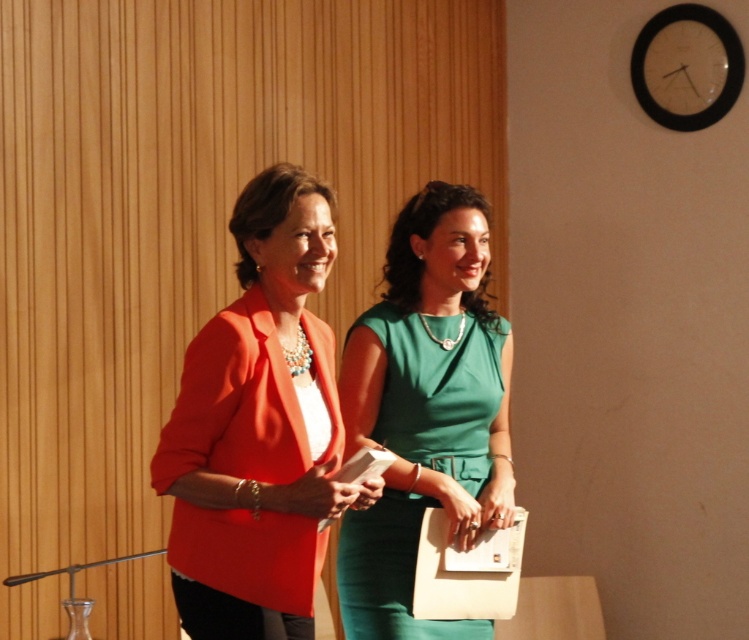
You are standing in a room with two women. The woman on the left is wearing a bright orange blazer and the woman on the right is in a green dress. There is a point at coordinates point (288, 605). Can you tell me how far this point is from you?

The point (288, 605) is 7.48 feet away from you.

You are organizing a photo shoot and need to arrange the two subjects so that their outfits are visible. Given the presence of the matte orange blazer at center and the green satin dress at center, which outfit should be positioned higher to ensure both are fully visible?

The matte orange blazer at center is shorter than the green satin dress at center, so positioning the matte orange blazer at center higher would allow both outfits to be fully visible.

In the scene shown: You are a photographer taking a portrait of the two women. You need to ensure that the matte orange blazer at center and the green satin dress at center are both clearly visible. Based on their positions, which clothing item is higher up in the frame?

The matte orange blazer at center is above the green satin dress at center, so it is higher up in the frame.